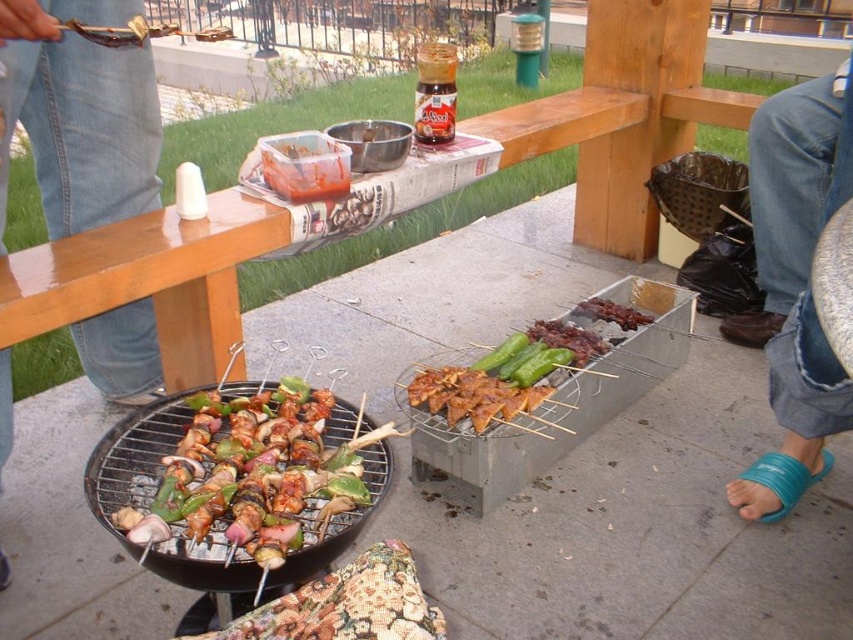
Question: Among these objects, which one is nearest to the camera?

Choices:
 (A) charred wooden skewers at center
 (B) charred meat skewers at center

Answer: (A)

Question: Which object is farther from the camera taking this photo?

Choices:
 (A) charred meat skewers at center
 (B) charred wooden skewers at center

Answer: (A)

Question: Is charred wooden skewers at center wider than charred meat skewers at center?

Choices:
 (A) yes
 (B) no

Answer: (A)

Question: Is blue rubber sandals at lower right to the right of charred wooden skewers at center from the viewer's perspective?

Choices:
 (A) no
 (B) yes

Answer: (B)

Question: Which point is closer to the camera?

Choices:
 (A) coord(596,316)
 (B) coord(422,401)
 (C) coord(759,108)
 (D) coord(108,493)

Answer: (D)

Question: From the image, what is the correct spatial relationship of grilled skewers at center in relation to blue rubber sandals at lower right?

Choices:
 (A) right
 (B) left

Answer: (B)